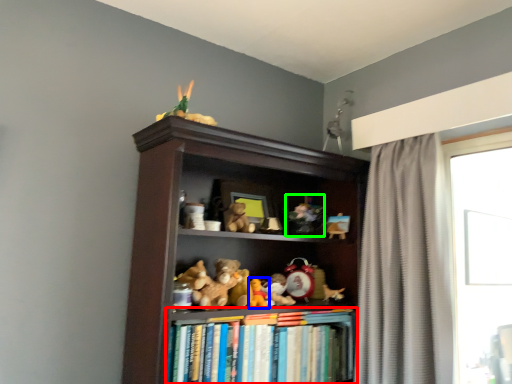
Question: Which object is positioned farthest from book (highlighted by a red box)? Select from toy (highlighted by a blue box) and toy (highlighted by a green box).

Choices:
 (A) toy
 (B) toy

Answer: (B)